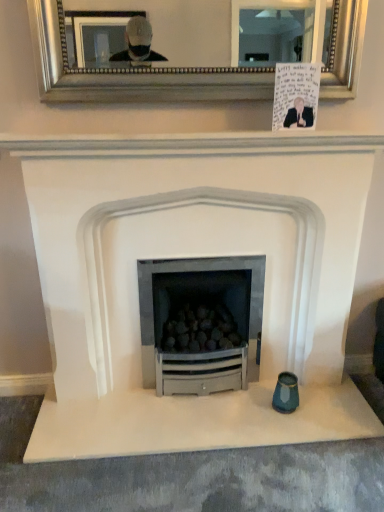
Question: Is handwritten paper at upper center positioned beyond the bounds of silver/golden mirror at upper center?

Choices:
 (A) yes
 (B) no

Answer: (A)

Question: Is handwritten paper at upper center oriented towards silver/golden mirror at upper center?

Choices:
 (A) yes
 (B) no

Answer: (B)

Question: Is handwritten paper at upper center beside silver/golden mirror at upper center?

Choices:
 (A) no
 (B) yes

Answer: (A)

Question: Can you confirm if handwritten paper at upper center is taller than silver/golden mirror at upper center?

Choices:
 (A) no
 (B) yes

Answer: (A)

Question: Does handwritten paper at upper center have a lesser height compared to silver/golden mirror at upper center?

Choices:
 (A) yes
 (B) no

Answer: (A)

Question: Is silver/golden mirror at upper center bigger or smaller than handwritten paper at upper center?

Choices:
 (A) small
 (B) big

Answer: (B)

Question: In the image, is silver/golden mirror at upper center positioned in front of or behind handwritten paper at upper center?

Choices:
 (A) front
 (B) behind

Answer: (A)

Question: From a real-world perspective, is silver/golden mirror at upper center positioned above or below handwritten paper at upper center?

Choices:
 (A) above
 (B) below

Answer: (A)

Question: Visually, is silver/golden mirror at upper center positioned to the left or to the right of handwritten paper at upper center?

Choices:
 (A) left
 (B) right

Answer: (A)

Question: Is white matte fireplace at center taller or shorter than handwritten paper at upper center?

Choices:
 (A) short
 (B) tall

Answer: (B)

Question: Choose the correct answer: Is white matte fireplace at center inside handwritten paper at upper center or outside it?

Choices:
 (A) outside
 (B) inside

Answer: (A)

Question: Considering the positions of point (94, 278) and point (279, 74), is point (94, 278) closer or farther from the camera than point (279, 74)?

Choices:
 (A) farther
 (B) closer

Answer: (A)

Question: From a real-world perspective, is white matte fireplace at center positioned above or below handwritten paper at upper center?

Choices:
 (A) below
 (B) above

Answer: (A)

Question: Is handwritten paper at upper center in front of or behind white matte fireplace at center in the image?

Choices:
 (A) behind
 (B) front

Answer: (A)

Question: Is point (317, 96) positioned closer to the camera than point (236, 252)?

Choices:
 (A) farther
 (B) closer

Answer: (B)